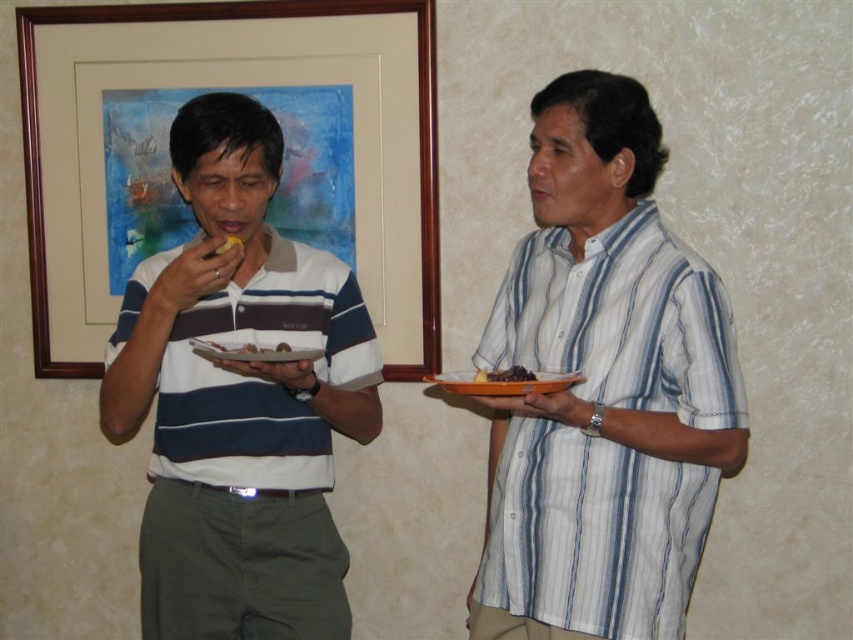
Is white matte plate at center positioned at the back of yellow matte food at center?

No, it is in front of yellow matte food at center.

Identify the location of white matte plate at center. (253, 352).

Find the location of a particular element. wooden frame at upper left is located at coordinates (231, 19).

Locate an element on the screen. wooden frame at upper left is located at coordinates (231, 19).

Does point (276, 264) lie in front of point (212, 355)?

No.

Does point (178, 344) come in front of point (292, 349)?

No, (178, 344) is further to viewer.

This screenshot has height=640, width=853. I want to click on white striped shirt at left, so click(x=239, y=397).